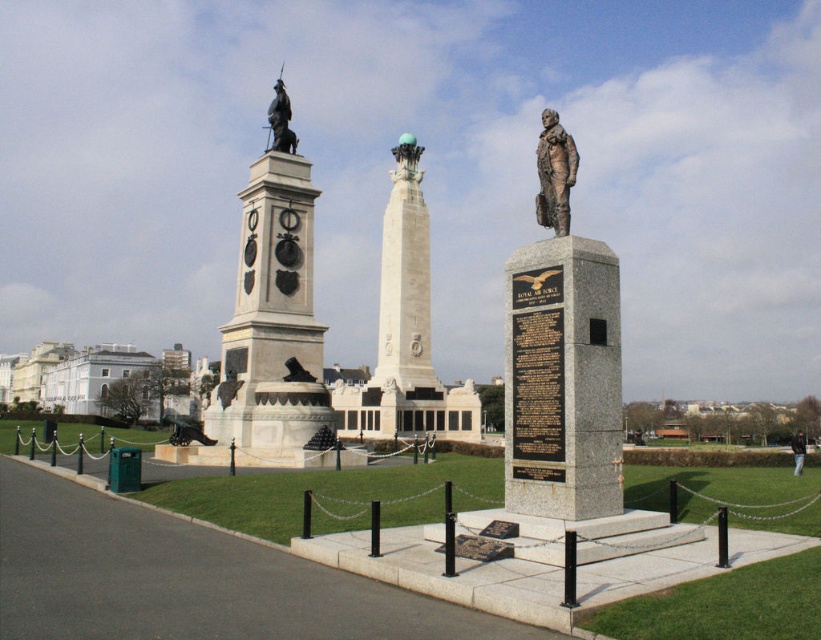
Question: Is bronze statue at center wider than bronze statue at upper center?

Choices:
 (A) no
 (B) yes

Answer: (A)

Question: Among these points, which one is farthest from the camera?

Choices:
 (A) (287, 132)
 (B) (644, 486)

Answer: (A)

Question: Where is granite monument at center located in relation to white marble statue at center in the image?

Choices:
 (A) left
 (B) right

Answer: (B)

Question: Which of the following is the closest to the observer?

Choices:
 (A) (411, 520)
 (B) (273, 129)

Answer: (A)

Question: Does bronze statue at center appear over bronze statue at upper center?

Choices:
 (A) yes
 (B) no

Answer: (B)

Question: Among these objects, which one is nearest to the camera?

Choices:
 (A) bronze statue at upper center
 (B) white marble tower at center
 (C) bronze statue at center

Answer: (C)